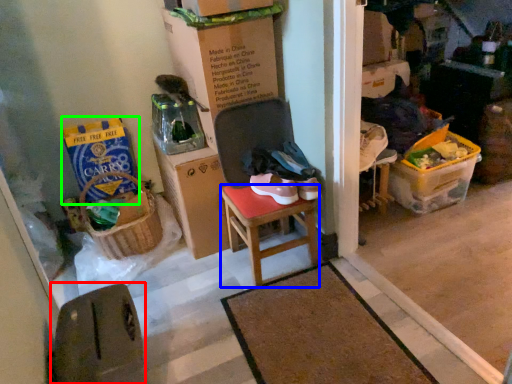
Question: Which object is positioned closest to chair (highlighted by a red box)? Select from stool (highlighted by a blue box) and box (highlighted by a green box).

Choices:
 (A) stool
 (B) box

Answer: (A)